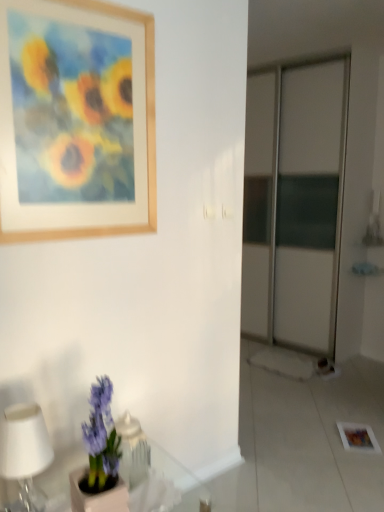
Where is `white matte table lamp at lower left`? The height and width of the screenshot is (512, 384). white matte table lamp at lower left is located at coordinates (25, 452).

In order to face translucent glass table at lower left, should I rotate leftwards or rightwards?

It's best to rotate left around 11.535 degrees.

Locate an element on the screen. This screenshot has width=384, height=512. white matte table lamp at lower left is located at coordinates (25, 452).

From a real-world perspective, between wooden picture frame at upper left and purple matte hyacinth at lower left, who is vertically higher?

From a 3D spatial view, wooden picture frame at upper left is above.

How different are the orientations of wooden picture frame at upper left and purple matte hyacinth at lower left in degrees?

There is a 4.64-degree angle between the facing directions of wooden picture frame at upper left and purple matte hyacinth at lower left.

Between wooden picture frame at upper left and purple matte hyacinth at lower left, which one appears on the left side from the viewer's perspective?

From the viewer's perspective, wooden picture frame at upper left appears more on the left side.

Considering the relative positions of wooden picture frame at upper left and purple matte hyacinth at lower left in the image provided, is wooden picture frame at upper left behind purple matte hyacinth at lower left?

Yes, wooden picture frame at upper left is behind purple matte hyacinth at lower left.

Is translucent glass table at lower left positioned beyond the bounds of purple matte hyacinth at lower left?

That's correct, translucent glass table at lower left is outside of purple matte hyacinth at lower left.

Locate an element on the screen. round table located below the purple matte hyacinth at lower left (from the image's perspective) is located at coordinates (61, 478).

Does translucent glass table at lower left touch purple matte hyacinth at lower left?

No, translucent glass table at lower left is not in contact with purple matte hyacinth at lower left.

Can you confirm if translucent glass table at lower left is bigger than purple matte hyacinth at lower left?

Yes.

Is wooden picture frame at upper left to the right of white matte table lamp at lower left from the viewer's perspective?

Yes, wooden picture frame at upper left is to the right of white matte table lamp at lower left.

Is wooden picture frame at upper left touching white matte table lamp at lower left?

There is a gap between wooden picture frame at upper left and white matte table lamp at lower left.

Consider the image. From their relative heights in the image, would you say wooden picture frame at upper left is taller or shorter than white matte table lamp at lower left?

Clearly, wooden picture frame at upper left is taller compared to white matte table lamp at lower left.

From the image's perspective, which is below, wooden picture frame at upper left or white matte table lamp at lower left?

white matte table lamp at lower left is shown below in the image.

From the image's perspective, relative to translucent glass table at lower left, is wooden picture frame at upper left above or below?

From the image's perspective, wooden picture frame at upper left appears above translucent glass table at lower left.

Is wooden picture frame at upper left touching translucent glass table at lower left?

wooden picture frame at upper left and translucent glass table at lower left are clearly separated.

Considering the relative sizes of wooden picture frame at upper left and translucent glass table at lower left in the image provided, is wooden picture frame at upper left bigger than translucent glass table at lower left?

No.

Can translucent glass table at lower left be found inside wooden picture frame at upper left?

That's incorrect, translucent glass table at lower left is not inside wooden picture frame at upper left.

Can you confirm if translucent glass table at lower left is shorter than wooden picture frame at upper left?

Indeed, translucent glass table at lower left has a lesser height compared to wooden picture frame at upper left.

Does translucent glass table at lower left turn towards wooden picture frame at upper left?

No, translucent glass table at lower left is not facing towards wooden picture frame at upper left.

From a real-world perspective, relative to wooden picture frame at upper left, is translucent glass table at lower left vertically above or below?

Clearly, from a real-world perspective, translucent glass table at lower left is below wooden picture frame at upper left.

Between white matte table lamp at lower left and wooden picture frame at upper left, which one appears on the left side from the viewer's perspective?

white matte table lamp at lower left is more to the left.

From the image's perspective, relative to wooden picture frame at upper left, is white matte table lamp at lower left above or below?

Based on their image positions, white matte table lamp at lower left is located beneath wooden picture frame at upper left.

Is wooden picture frame at upper left at the back of white matte table lamp at lower left?

No, white matte table lamp at lower left is not facing away from wooden picture frame at upper left.

From the image's perspective, is purple matte hyacinth at lower left on wooden picture frame at upper left?

Incorrect, from the image's perspective, purple matte hyacinth at lower left is lower than wooden picture frame at upper left.

Considering the relative sizes of purple matte hyacinth at lower left and wooden picture frame at upper left in the image provided, is purple matte hyacinth at lower left bigger than wooden picture frame at upper left?

Incorrect, purple matte hyacinth at lower left is not larger than wooden picture frame at upper left.

Is purple matte hyacinth at lower left in contact with wooden picture frame at upper left?

No, purple matte hyacinth at lower left is not beside wooden picture frame at upper left.

Where is `houseplant below the wooden picture frame at upper left (from the image's perspective)`? This screenshot has height=512, width=384. houseplant below the wooden picture frame at upper left (from the image's perspective) is located at coordinates (100, 458).

Locate an element on the screen. The image size is (384, 512). houseplant that appears above the translucent glass table at lower left (from the image's perspective) is located at coordinates (100, 458).

Looking at the image, which one is located closer to purple matte hyacinth at lower left, wooden picture frame at upper left or translucent glass table at lower left?

translucent glass table at lower left is closer to purple matte hyacinth at lower left.

Considering their positions, is purple matte hyacinth at lower left positioned further to translucent glass table at lower left than wooden picture frame at upper left?

The object further to translucent glass table at lower left is wooden picture frame at upper left.

From the image, which object appears to be farther from purple matte hyacinth at lower left, white matte table lamp at lower left or translucent glass table at lower left?

translucent glass table at lower left is positioned further to the anchor purple matte hyacinth at lower left.

When comparing their distances from white matte table lamp at lower left, does purple matte hyacinth at lower left or wooden picture frame at upper left seem closer?

purple matte hyacinth at lower left.

Considering their positions, is translucent glass table at lower left positioned closer to purple matte hyacinth at lower left than white matte table lamp at lower left?

white matte table lamp at lower left is closer to purple matte hyacinth at lower left.

Looking at this image, when comparing their distances from wooden picture frame at upper left, does white matte table lamp at lower left or translucent glass table at lower left seem further?

translucent glass table at lower left lies further to wooden picture frame at upper left than the other object.

Looking at the image, which one is located further to wooden picture frame at upper left, purple matte hyacinth at lower left or translucent glass table at lower left?

Based on the image, translucent glass table at lower left appears to be further to wooden picture frame at upper left.

From the image, which object appears to be nearer to translucent glass table at lower left, white matte table lamp at lower left or wooden picture frame at upper left?

white matte table lamp at lower left lies closer to translucent glass table at lower left than the other object.

Locate an element on the screen. This screenshot has height=512, width=384. houseplant that lies between wooden picture frame at upper left and translucent glass table at lower left from top to bottom is located at coordinates click(x=100, y=458).

Image resolution: width=384 pixels, height=512 pixels. What are the coordinates of `table lamp between purple matte hyacinth at lower left and translucent glass table at lower left from top to bottom` in the screenshot? It's located at (25, 452).

Find the location of a particular element. Image resolution: width=384 pixels, height=512 pixels. table lamp between wooden picture frame at upper left and translucent glass table at lower left vertically is located at coordinates (25, 452).

This screenshot has width=384, height=512. Find the location of `houseplant that lies between wooden picture frame at upper left and white matte table lamp at lower left from top to bottom`. houseplant that lies between wooden picture frame at upper left and white matte table lamp at lower left from top to bottom is located at coordinates [100, 458].